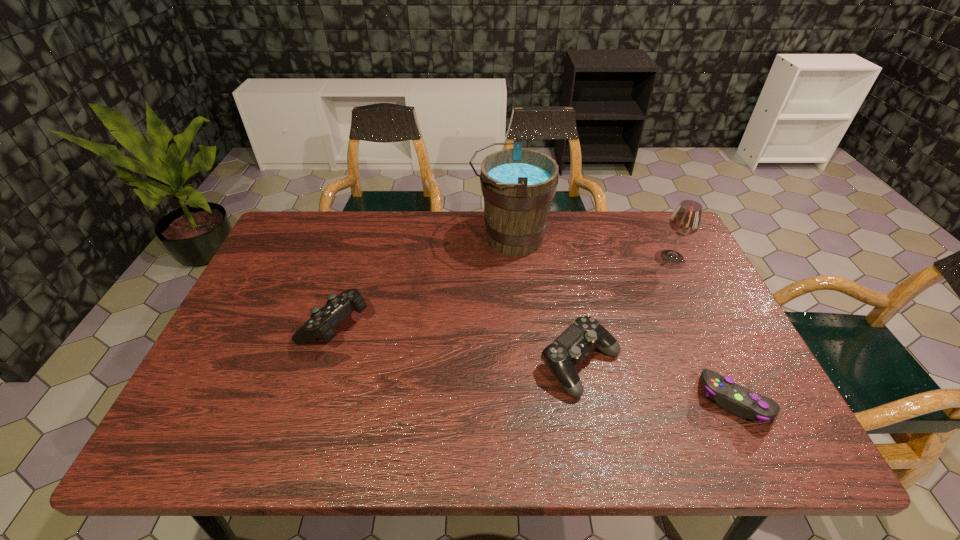
Find the location of `free spot that satisfies the following two spatial constraints: 1. on the back side of the shortest control; 2. with a handle on the side of the tallest object`. free spot that satisfies the following two spatial constraints: 1. on the back side of the shortest control; 2. with a handle on the side of the tallest object is located at coordinates (659, 239).

Identify the location of free location that satisfies the following two spatial constraints: 1. with a handle on the side of the tallest object; 2. on the back side of the wineglass. This screenshot has width=960, height=540. (512, 257).

You are a GUI agent. You are given a task and a screenshot of the screen. Output one action in this format:
    pyautogui.click(x=<x>, y=<y>)
    Task: Click on the vacant region that satisfies the following two spatial constraints: 1. with a handle on the side of the tallest object; 2. on the right side of the shortest control
    The width and height of the screenshot is (960, 540).
    Given the screenshot: What is the action you would take?
    pyautogui.click(x=523, y=400)

This screenshot has height=540, width=960. Find the location of `vacant space that satisfies the following two spatial constraints: 1. with a handle on the side of the wine bucket; 2. on the back side of the second control from right to left`. vacant space that satisfies the following two spatial constraints: 1. with a handle on the side of the wine bucket; 2. on the back side of the second control from right to left is located at coordinates (520, 364).

Locate an element on the screen. vacant position in the image that satisfies the following two spatial constraints: 1. on the back side of the second control from left to right; 2. with a handle on the side of the wine bucket is located at coordinates (555, 239).

The height and width of the screenshot is (540, 960). I want to click on blank space that satisfies the following two spatial constraints: 1. with a handle on the side of the wine bucket; 2. on the front side of the leftmost object, so click(517, 325).

Where is `vacant region that satisfies the following two spatial constraints: 1. with a handle on the side of the second tallest object; 2. on the right side of the wine bucket`? vacant region that satisfies the following two spatial constraints: 1. with a handle on the side of the second tallest object; 2. on the right side of the wine bucket is located at coordinates (512, 257).

Find the location of a particular element. vacant region that satisfies the following two spatial constraints: 1. on the back side of the shortest control; 2. on the left side of the wineglass is located at coordinates (667, 257).

Image resolution: width=960 pixels, height=540 pixels. In order to click on vacant area that satisfies the following two spatial constraints: 1. on the back side of the leftmost control; 2. on the left side of the wineglass in this screenshot , I will do `click(356, 257)`.